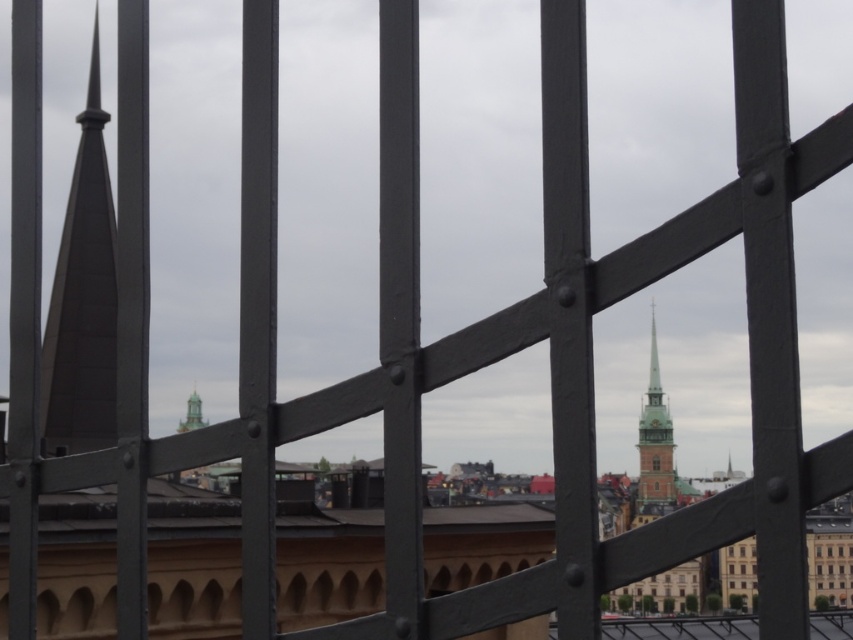
Question: Does dark gray stone spire at left have a lesser width compared to greenish-brown stone spire at center-right?

Choices:
 (A) no
 (B) yes

Answer: (A)

Question: Which of the following is the farthest from the observer?

Choices:
 (A) dark gray stone spire at left
 (B) greenish-brown stone spire at center-right

Answer: (B)

Question: Among these objects, which one is farthest from the camera?

Choices:
 (A) dark gray stone spire at left
 (B) greenish-brown stone spire at center-right

Answer: (B)

Question: Is dark gray stone spire at left bigger than greenish-brown stone spire at center-right?

Choices:
 (A) yes
 (B) no

Answer: (A)

Question: Does dark gray stone spire at left appear under greenish-brown stone spire at center-right?

Choices:
 (A) yes
 (B) no

Answer: (B)